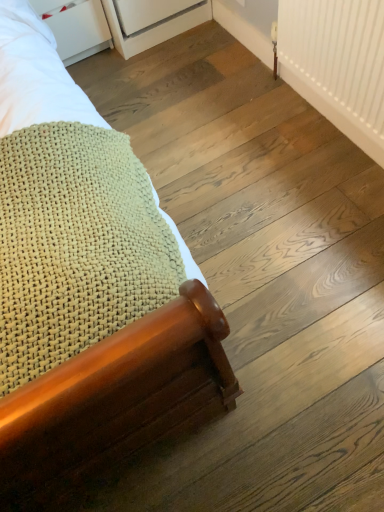
The height and width of the screenshot is (512, 384). Find the location of `free point in front of white plastic radiator at upper right`. free point in front of white plastic radiator at upper right is located at coordinates (316, 201).